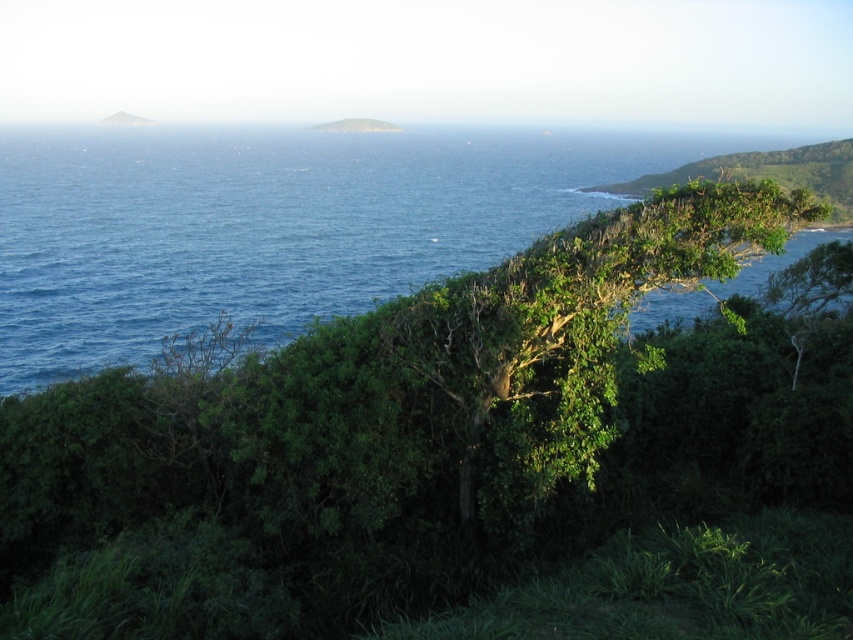
Question: Based on their relative distances, which object is farther from the blue liquid water at upper left?

Choices:
 (A) green leafy hillside at upper center
 (B) green leafy hillside at upper left
 (C) green leafy tree at center

Answer: (B)

Question: Considering the real-world distances, which object is closest to the green leafy tree at center?

Choices:
 (A) green leafy hillside at upper right
 (B) green leafy hillside at upper left
 (C) blue liquid water at upper left

Answer: (A)

Question: Is blue liquid water at upper left positioned before green leafy hillside at upper right?

Choices:
 (A) yes
 (B) no

Answer: (B)

Question: Does blue liquid water at upper left appear over green leafy hillside at upper left?

Choices:
 (A) no
 (B) yes

Answer: (A)

Question: Among these points, which one is nearest to the camera?

Choices:
 (A) (370, 125)
 (B) (726, 269)
 (C) (119, 115)
 (D) (193, 244)

Answer: (B)

Question: Is blue liquid water at upper left thinner than green leafy hillside at upper right?

Choices:
 (A) no
 (B) yes

Answer: (A)